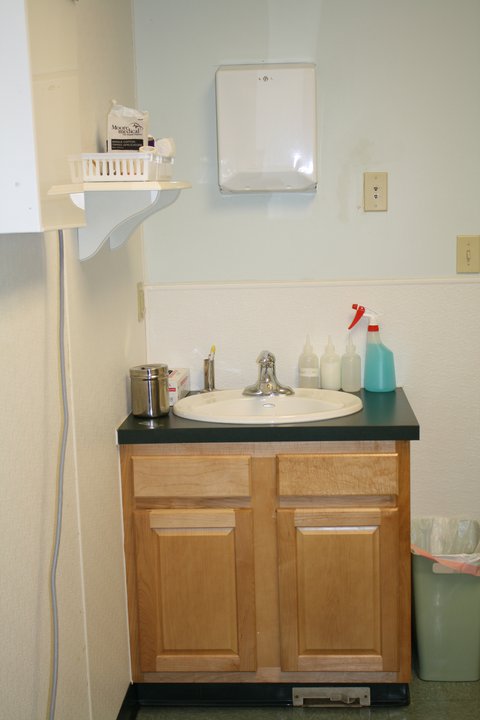
Locate an element on the screen. The width and height of the screenshot is (480, 720). door is located at coordinates (217, 572).